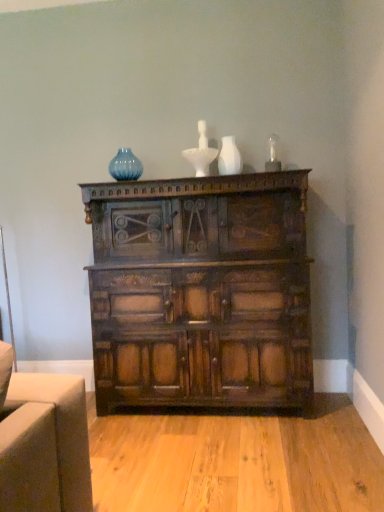
Question: Is dark brown wood chest of drawers at center turned away from blue glass vase at upper center?

Choices:
 (A) yes
 (B) no

Answer: (B)

Question: Does dark brown wood chest of drawers at center have a lesser width compared to blue glass vase at upper center?

Choices:
 (A) yes
 (B) no

Answer: (B)

Question: Does dark brown wood chest of drawers at center lie behind blue glass vase at upper center?

Choices:
 (A) no
 (B) yes

Answer: (A)

Question: Is dark brown wood chest of drawers at center not near blue glass vase at upper center?

Choices:
 (A) no
 (B) yes

Answer: (A)

Question: Is dark brown wood chest of drawers at center to the right of blue glass vase at upper center from the viewer's perspective?

Choices:
 (A) no
 (B) yes

Answer: (B)

Question: Considering the positions of blue glass vase at upper center and white matte vase at upper center in the image, is blue glass vase at upper center taller or shorter than white matte vase at upper center?

Choices:
 (A) short
 (B) tall

Answer: (A)

Question: From a real-world perspective, is blue glass vase at upper center positioned above or below white matte vase at upper center?

Choices:
 (A) above
 (B) below

Answer: (A)

Question: Is blue glass vase at upper center in front of or behind white matte vase at upper center in the image?

Choices:
 (A) behind
 (B) front

Answer: (A)

Question: Is blue glass vase at upper center bigger or smaller than white matte vase at upper center?

Choices:
 (A) small
 (B) big

Answer: (B)

Question: From a real-world perspective, is dark brown wood chest of drawers at center above or below blue glass vase at upper center?

Choices:
 (A) below
 (B) above

Answer: (A)

Question: Does point (145, 269) appear closer or farther from the camera than point (130, 154)?

Choices:
 (A) farther
 (B) closer

Answer: (B)

Question: Would you say dark brown wood chest of drawers at center is to the left or to the right of blue glass vase at upper center in the picture?

Choices:
 (A) left
 (B) right

Answer: (B)

Question: Considering the positions of dark brown wood chest of drawers at center and blue glass vase at upper center in the image, is dark brown wood chest of drawers at center taller or shorter than blue glass vase at upper center?

Choices:
 (A) short
 (B) tall

Answer: (B)

Question: In terms of width, does white matte vase at upper center look wider or thinner when compared to dark brown wood chest of drawers at center?

Choices:
 (A) thin
 (B) wide

Answer: (A)

Question: Does point (226, 165) appear closer or farther from the camera than point (225, 276)?

Choices:
 (A) closer
 (B) farther

Answer: (B)